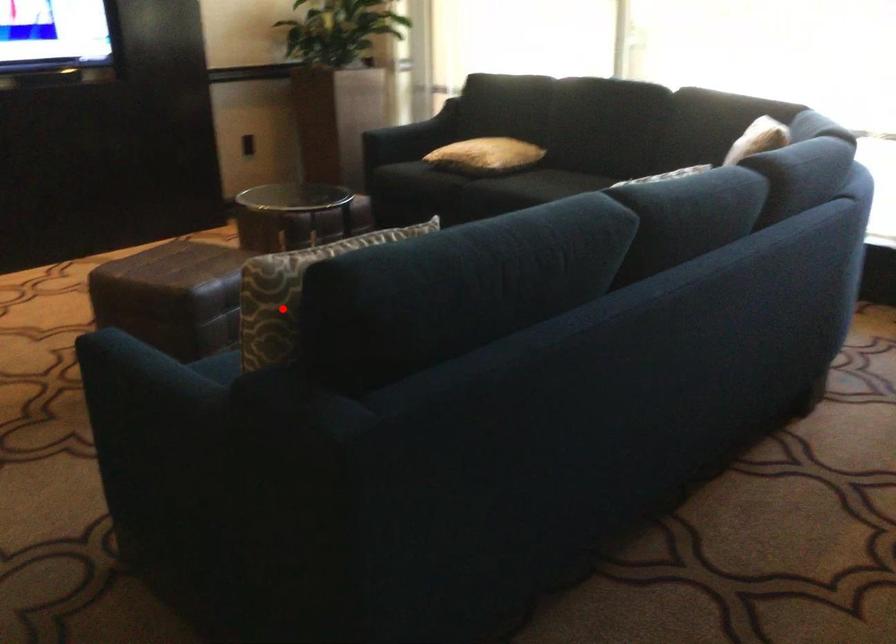
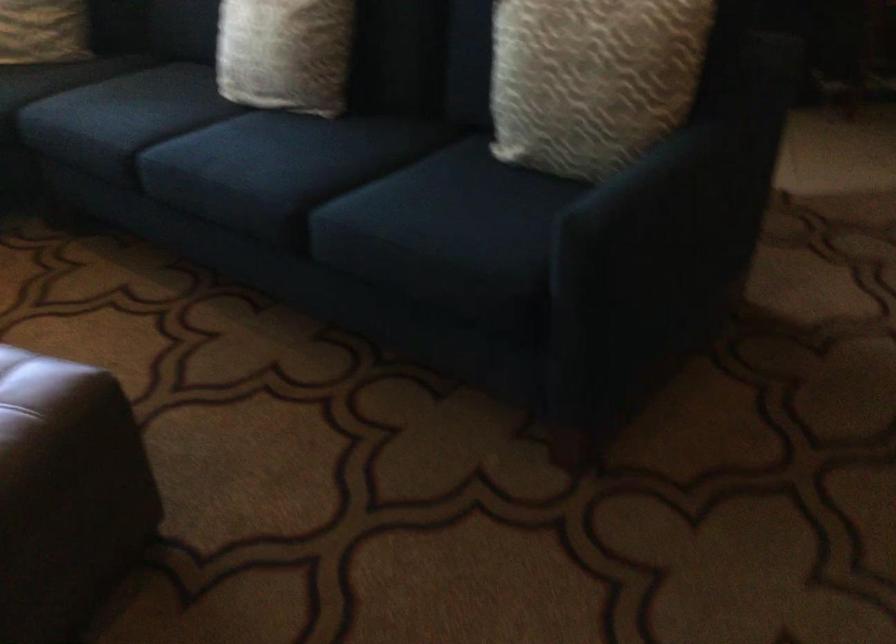
Question: I am providing you with two images of the same scene from different viewpoints. A red point is marked on the first image. Can you still see the location of the red point in image 2?

Choices:
 (A) Yes
 (B) No

Answer: (A)